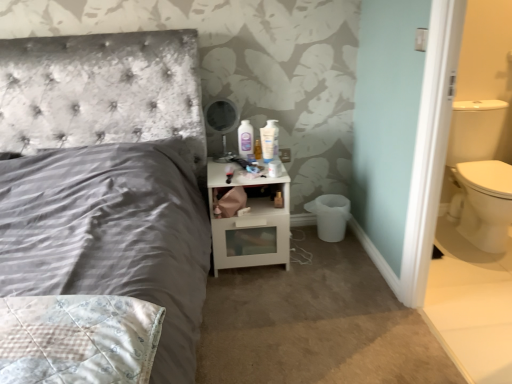
Question: Considering the relative sizes of white glossy mouthwash at upper center and white glossy nightstand at center in the image provided, is white glossy mouthwash at upper center thinner than white glossy nightstand at center?

Choices:
 (A) yes
 (B) no

Answer: (A)

Question: From the image's perspective, would you say white glossy mouthwash at upper center is shown under white glossy nightstand at center?

Choices:
 (A) no
 (B) yes

Answer: (A)

Question: Is white glossy mouthwash at upper center smaller than white glossy nightstand at center?

Choices:
 (A) no
 (B) yes

Answer: (B)

Question: From a real-world perspective, is white glossy mouthwash at upper center beneath white glossy nightstand at center?

Choices:
 (A) no
 (B) yes

Answer: (A)

Question: Is white glossy mouthwash at upper center facing towards white glossy nightstand at center?

Choices:
 (A) no
 (B) yes

Answer: (A)

Question: In terms of size, does white glossy nightstand at center appear bigger or smaller than white glossy mouthwash at upper center?

Choices:
 (A) small
 (B) big

Answer: (B)

Question: From a real-world perspective, is white glossy nightstand at center physically located above or below white glossy mouthwash at upper center?

Choices:
 (A) above
 (B) below

Answer: (B)

Question: Would you say white glossy nightstand at center is inside or outside white glossy mouthwash at upper center?

Choices:
 (A) inside
 (B) outside

Answer: (B)

Question: Considering the positions of white glossy nightstand at center and white glossy mouthwash at upper center in the image, is white glossy nightstand at center wider or thinner than white glossy mouthwash at upper center?

Choices:
 (A) thin
 (B) wide

Answer: (B)

Question: Is point (272, 140) closer or farther from the camera than point (239, 208)?

Choices:
 (A) farther
 (B) closer

Answer: (A)

Question: Is white glossy mouthwash at upper center bigger or smaller than white matte toilet paper at lower right?

Choices:
 (A) small
 (B) big

Answer: (B)

Question: Is white glossy mouthwash at upper center in front of or behind white matte toilet paper at lower right in the image?

Choices:
 (A) behind
 (B) front

Answer: (A)

Question: Is white glossy mouthwash at upper center taller or shorter than white matte toilet paper at lower right?

Choices:
 (A) short
 (B) tall

Answer: (B)

Question: From a real-world perspective, is white glossy nightstand at center above or below white matte toilet paper at lower right?

Choices:
 (A) above
 (B) below

Answer: (B)

Question: From the image's perspective, is white glossy nightstand at center above or below white matte toilet paper at lower right?

Choices:
 (A) above
 (B) below

Answer: (B)